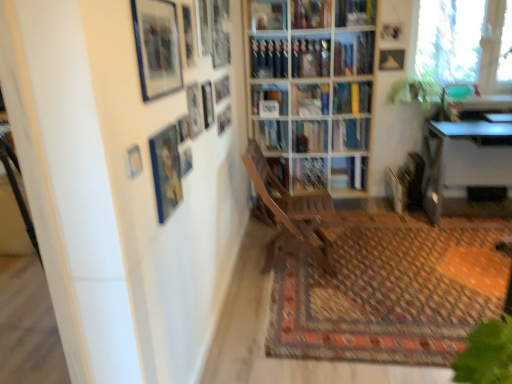
Question: From a real-world perspective, is matte black picture frame at upper center, the fifth picture frame when ordered from front to back, physically above metallic silver desk at right?

Choices:
 (A) yes
 (B) no

Answer: (A)

Question: Is matte black picture frame at upper center, which is the 6th picture frame in left-to-right order, bigger than metallic silver desk at right?

Choices:
 (A) no
 (B) yes

Answer: (A)

Question: Does matte black picture frame at upper center, the 7th picture frame from the back, contain metallic silver desk at right?

Choices:
 (A) yes
 (B) no

Answer: (B)

Question: From the image's perspective, is matte black picture frame at upper center, the 7th picture frame from the back, above metallic silver desk at right?

Choices:
 (A) yes
 (B) no

Answer: (A)

Question: Considering the relative sizes of matte black picture frame at upper center, the 7th picture frame from the back, and metallic silver desk at right in the image provided, is matte black picture frame at upper center, the 7th picture frame from the back, wider than metallic silver desk at right?

Choices:
 (A) yes
 (B) no

Answer: (B)

Question: Could you tell me if matte black picture frame at upper center, which is the 6th picture frame in left-to-right order, is turned towards metallic silver desk at right?

Choices:
 (A) yes
 (B) no

Answer: (B)

Question: Does transparent glass window at upper right appear on the right side of metallic silver desk at right?

Choices:
 (A) yes
 (B) no

Answer: (B)

Question: Is metallic silver desk at right inside transparent glass window at upper right?

Choices:
 (A) no
 (B) yes

Answer: (A)

Question: From the image's perspective, is transparent glass window at upper right under metallic silver desk at right?

Choices:
 (A) yes
 (B) no

Answer: (B)

Question: Can you see transparent glass window at upper right touching metallic silver desk at right?

Choices:
 (A) yes
 (B) no

Answer: (B)

Question: Can you confirm if transparent glass window at upper right is smaller than metallic silver desk at right?

Choices:
 (A) no
 (B) yes

Answer: (B)

Question: Is metallic silver desk at right at the back of transparent glass window at upper right?

Choices:
 (A) no
 (B) yes

Answer: (A)

Question: Would you say blue glossy picture frame at upper left, the second picture frame positioned from the front, is outside wooden chair at center?

Choices:
 (A) no
 (B) yes

Answer: (B)